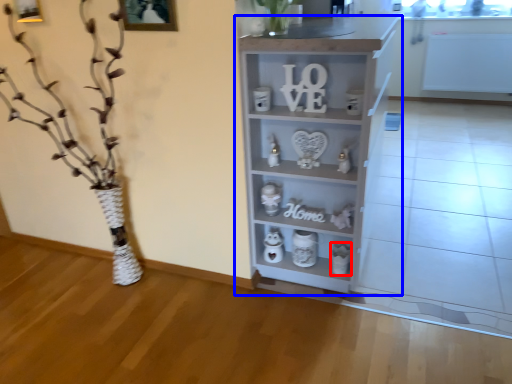
Question: Which object appears closest to the camera in this image, toy (highlighted by a red box) or shelf (highlighted by a blue box)?

Choices:
 (A) toy
 (B) shelf

Answer: (B)